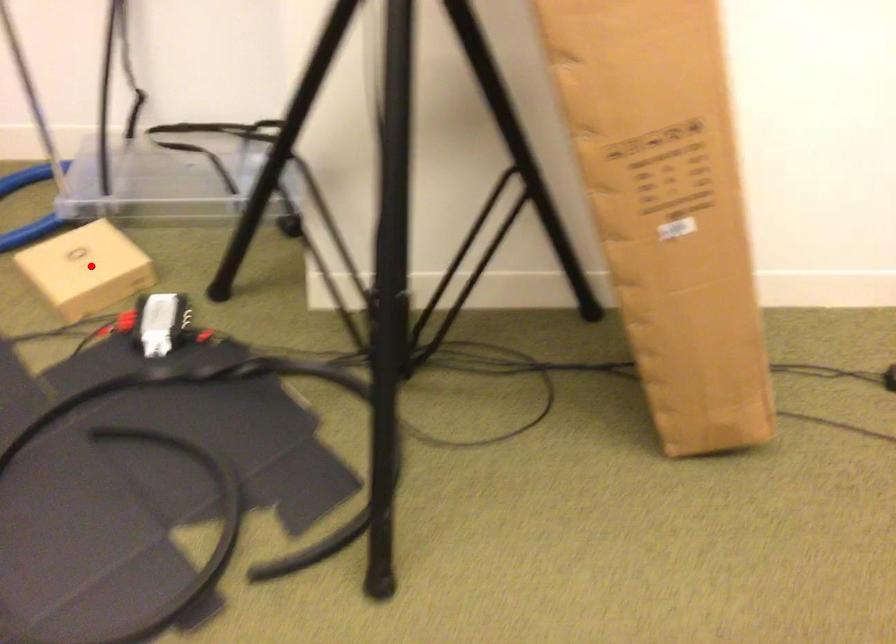
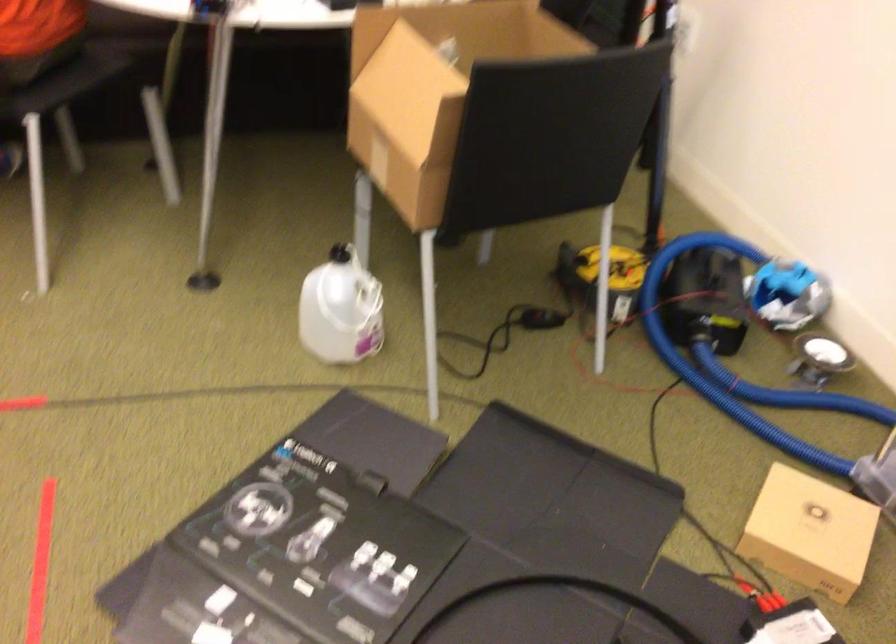
In the second image, find the point that corresponds to the highlighted location in the first image.

(810, 532)